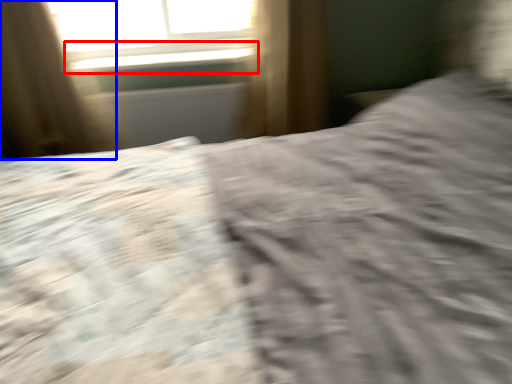
Question: Which object appears farthest to the camera in this image, window sill (highlighted by a red box) or curtain (highlighted by a blue box)?

Choices:
 (A) window sill
 (B) curtain

Answer: (A)